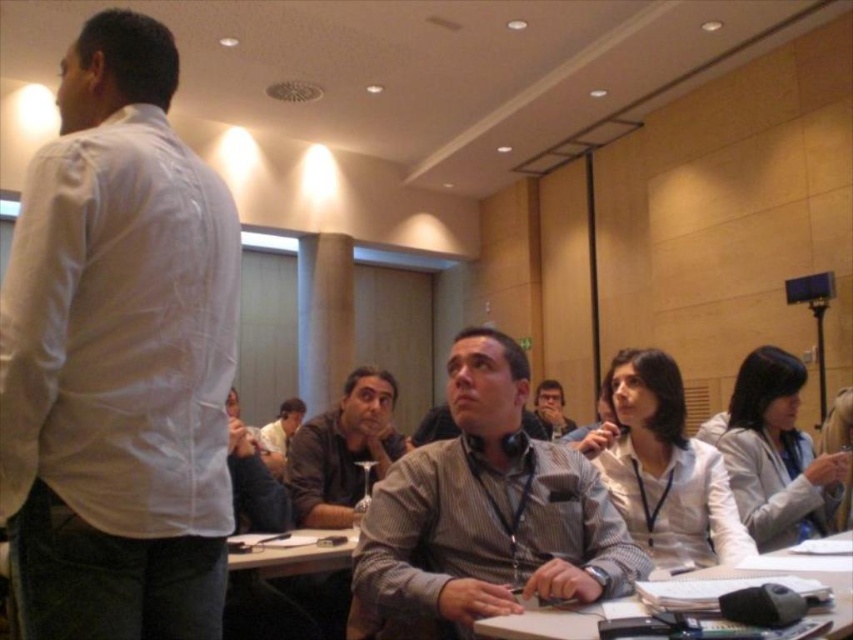
You are sitting at the back of the conference room and want to see the speaker clearly. There are two people in front of you wearing striped cotton shirt at center and gray striped shirt at center. Which person is blocking your view more?

The striped cotton shirt at center is blocking your view more because it is in front of the gray striped shirt at center.